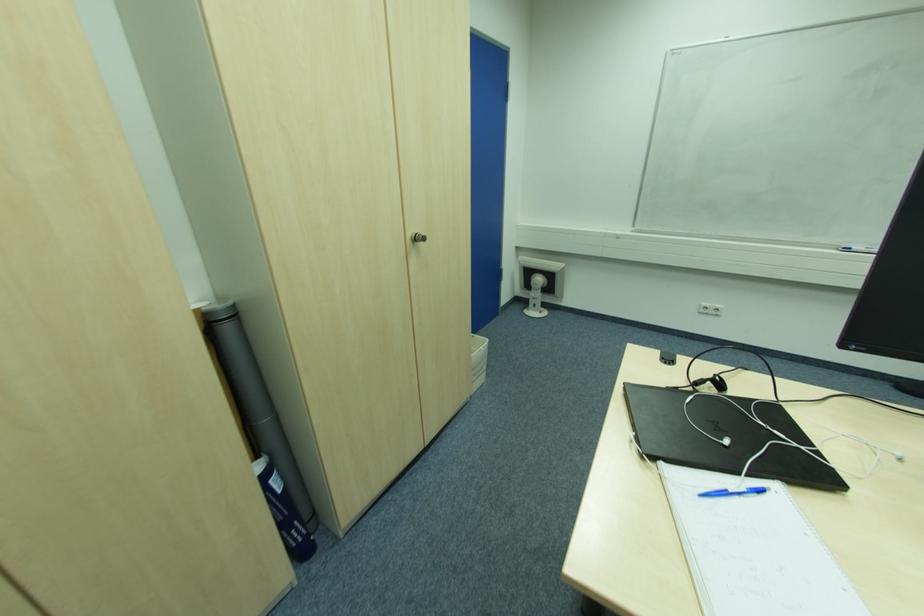
The location [478,361] corresponds to which object?

It refers to a white wastebasket.